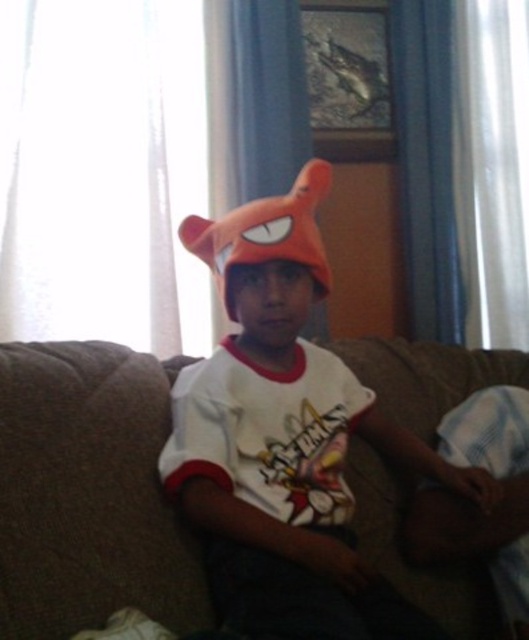
Can you confirm if white fabric at lower right is taller than orange plush hat at center?

Indeed, white fabric at lower right has a greater height compared to orange plush hat at center.

Which of these two, white fabric at lower right or orange plush hat at center, stands shorter?

orange plush hat at center

Does point (437, 504) lie in front of point (238, 246)?

No, it is not.

Image resolution: width=529 pixels, height=640 pixels. What are the coordinates of `white fabric at lower right` in the screenshot? It's located at (473, 506).

Is brown fabric couch at center bigger than matte orange hat at center?

No.

Between brown fabric couch at center and matte orange hat at center, which one is positioned lower?

brown fabric couch at center

Between point (149, 490) and point (248, 256), which one is positioned behind?

The point (248, 256) is more distant.

Locate an element on the screen. brown fabric couch at center is located at coordinates (88, 492).

Is brown fabric couch at center below white fabric at lower right?

Actually, brown fabric couch at center is above white fabric at lower right.

Is point (480, 570) behind point (515, 410)?

That is False.

Locate an element on the screen. This screenshot has width=529, height=640. brown fabric couch at center is located at coordinates (88, 492).